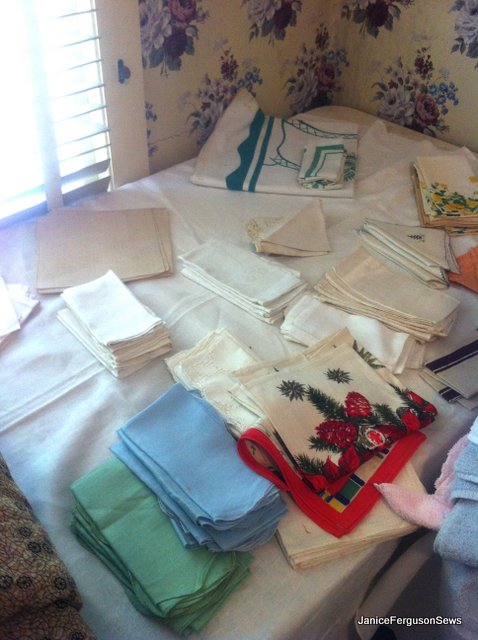
I want to click on towels, so click(x=463, y=536), click(x=429, y=511), click(x=471, y=463).